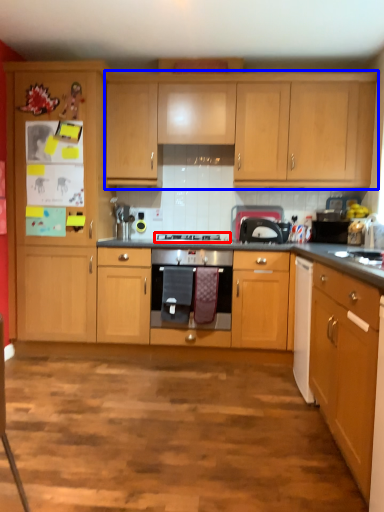
Question: Among these objects, which one is nearest to the camera, gas stove (highlighted by a red box) or cabinetry (highlighted by a blue box)?

Choices:
 (A) gas stove
 (B) cabinetry

Answer: (A)